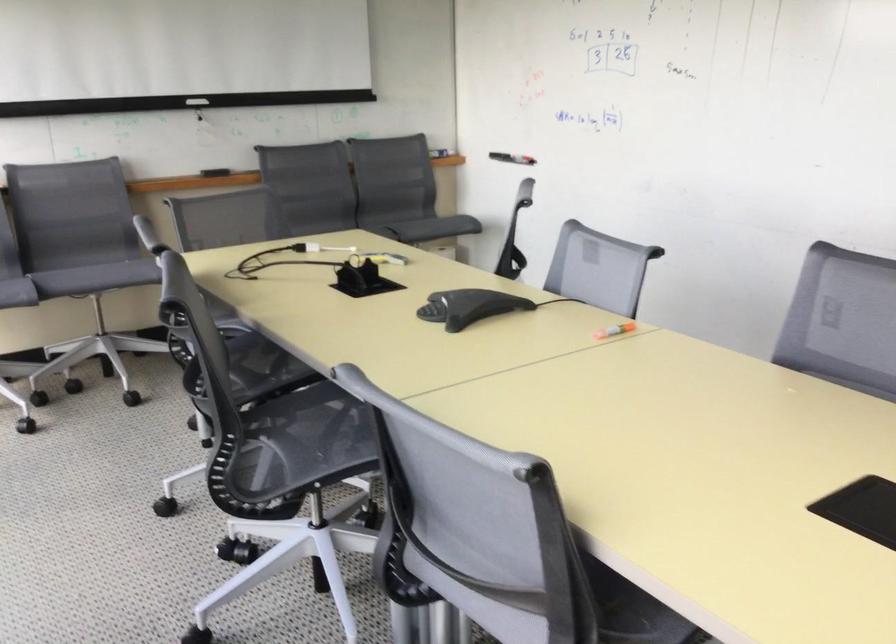
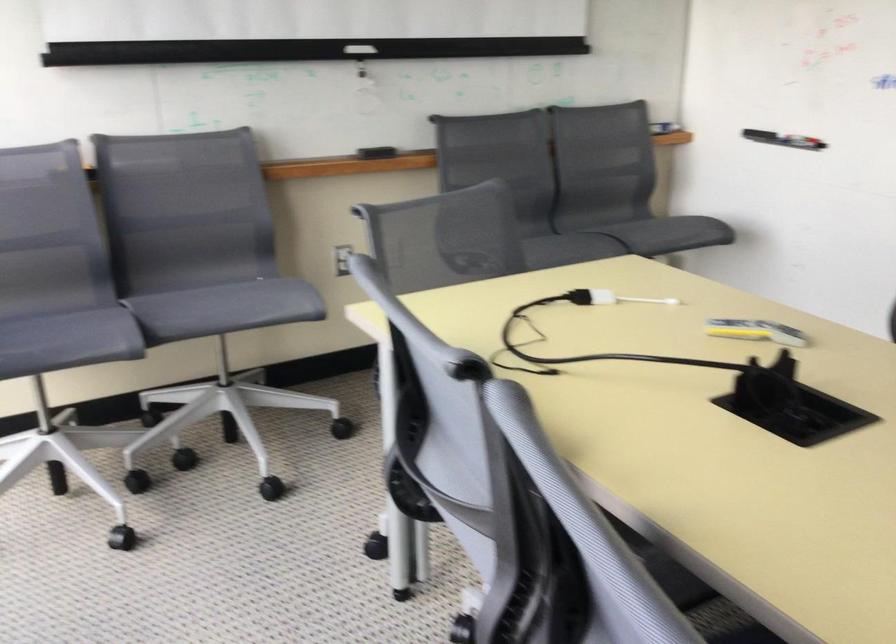
Where in the second image is the point corresponding to (x=95, y=274) from the first image?

(225, 308)